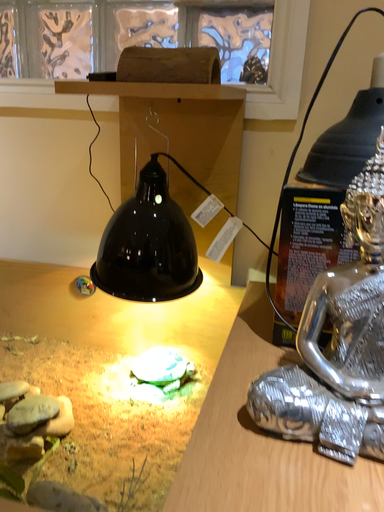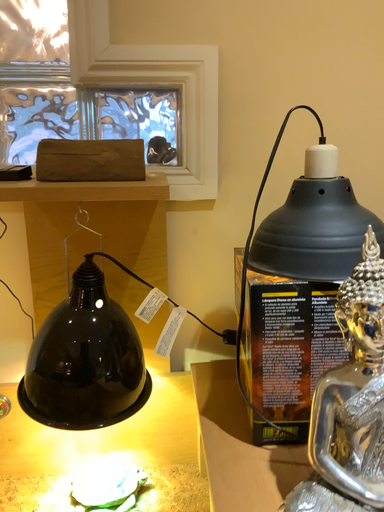
Question: How did the camera likely rotate when shooting the video?

Choices:
 (A) rotated upward
 (B) rotated downward

Answer: (A)